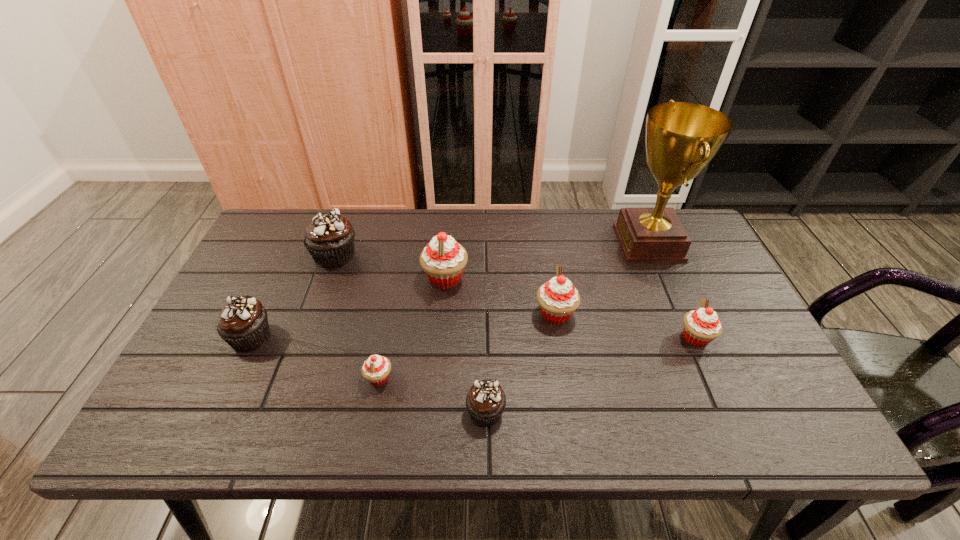
Where is `the second smallest brown cupcake`? the second smallest brown cupcake is located at coordinates (243, 324).

You are a GUI agent. You are given a task and a screenshot of the screen. Output one action in this format:
    pyautogui.click(x=<x>, y=<y>)
    Task: Click on the leftmost object
    This screenshot has height=540, width=960.
    Given the screenshot: What is the action you would take?
    pyautogui.click(x=243, y=324)

Locate an element on the screen. the smallest pink cupcake is located at coordinates (376, 369).

Locate an element on the screen. The height and width of the screenshot is (540, 960). the sixth farthest cupcake is located at coordinates (376, 369).

Image resolution: width=960 pixels, height=540 pixels. Identify the location of the nearest object. (485, 402).

Locate an element on the screen. Image resolution: width=960 pixels, height=540 pixels. the fifth object from left to right is located at coordinates (485, 402).

Where is `vacant space positioned 0.240m on the plaque of the gold award`? The width and height of the screenshot is (960, 540). vacant space positioned 0.240m on the plaque of the gold award is located at coordinates (539, 243).

Image resolution: width=960 pixels, height=540 pixels. I want to click on vacant space located on the plaque of the gold award, so click(x=567, y=243).

Identify the location of vacant area situated 0.080m on the plaque of the gold award. (590, 243).

The width and height of the screenshot is (960, 540). What are the coordinates of `vacant region located 0.290m on the left of the tallest cupcake` in the screenshot? It's located at (321, 279).